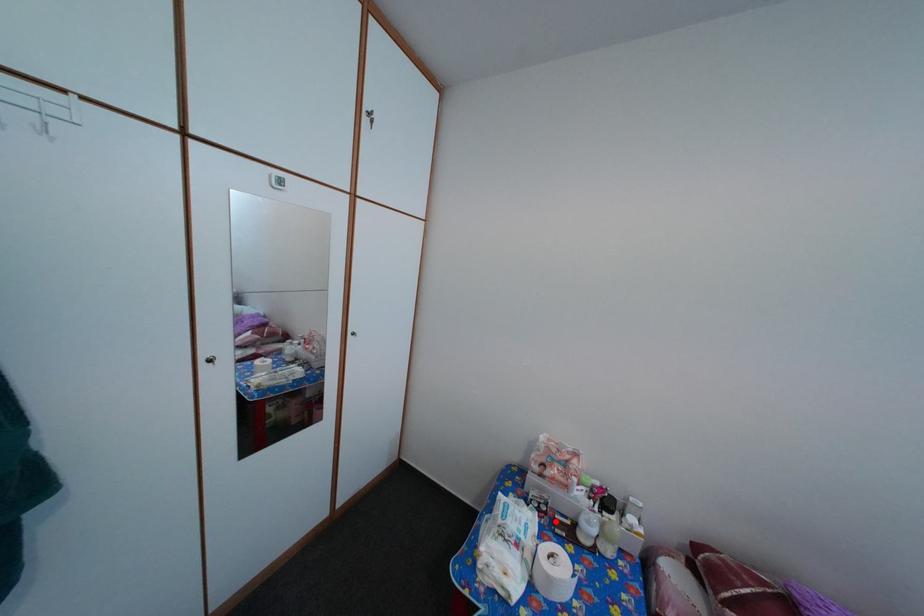
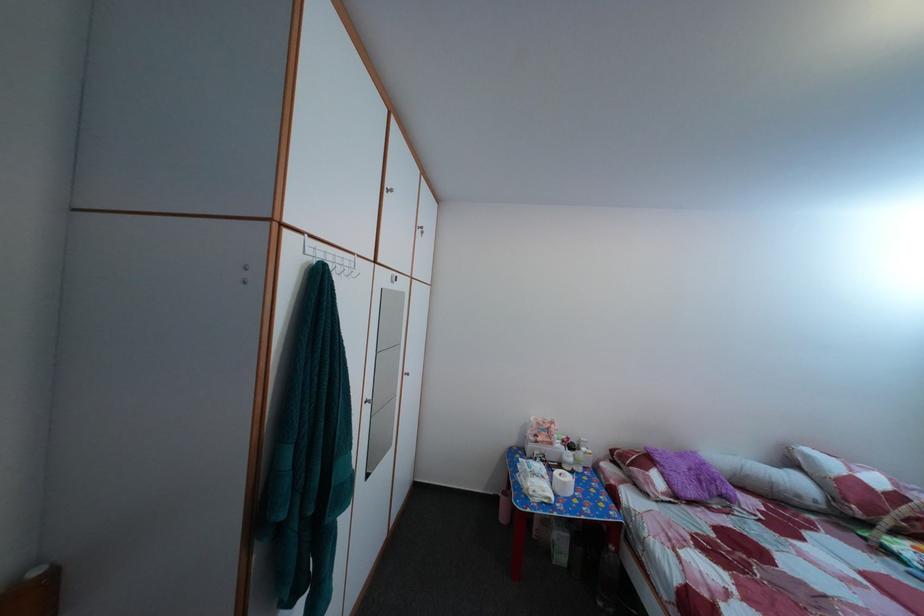
Question: A red point is marked in image1. In image2, is the corresponding 3D point closer to the camera or farther? Reply with the corresponding letter.

Choices:
 (A) The corresponding 3D point is closer.
 (B) The corresponding 3D point is farther.

Answer: (B)